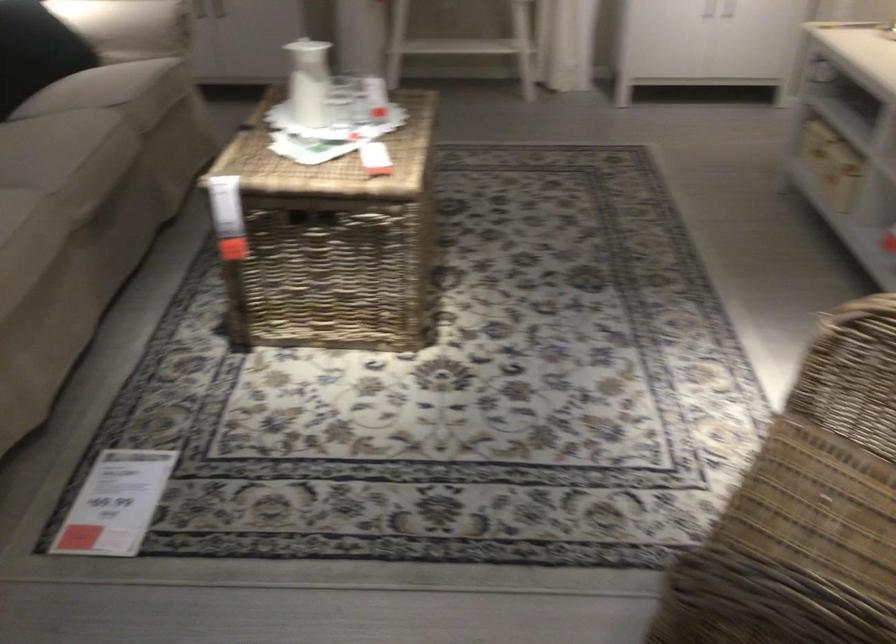
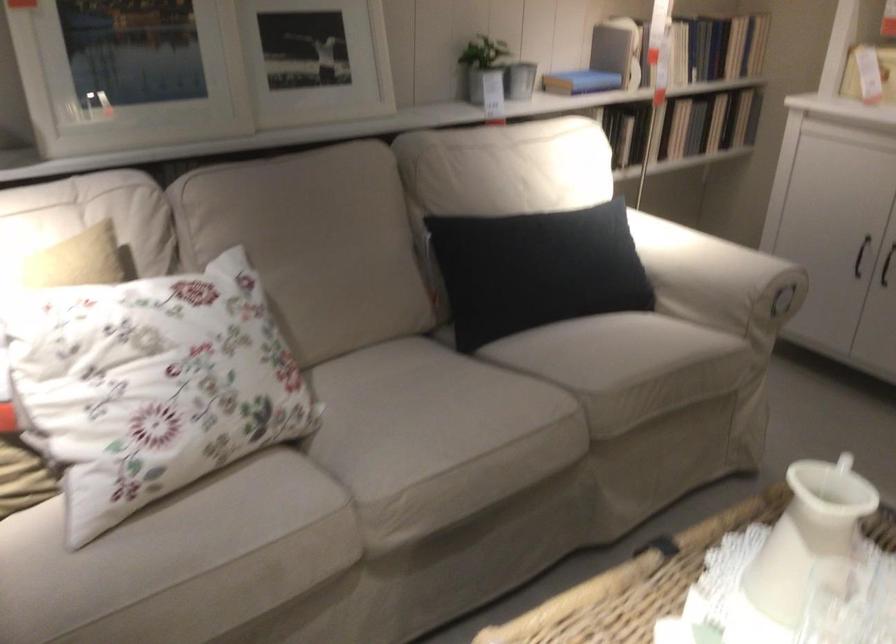
In the second image, find the point that corresponds to pixel 319 84 in the first image.

(803, 552)